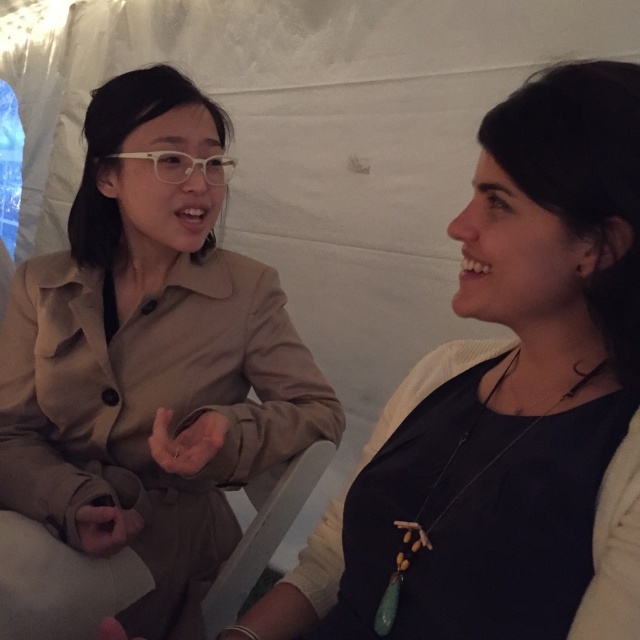
Is matte black sweater at center bigger than tan fabric coat at left?

Actually, matte black sweater at center might be smaller than tan fabric coat at left.

Is matte black sweater at center wider than tan fabric coat at left?

In fact, matte black sweater at center might be narrower than tan fabric coat at left.

Who is more distant from viewer, (480,264) or (132,276)?

Positioned behind is point (132,276).

Locate an element on the screen. Image resolution: width=640 pixels, height=640 pixels. matte black sweater at center is located at coordinates click(506, 406).